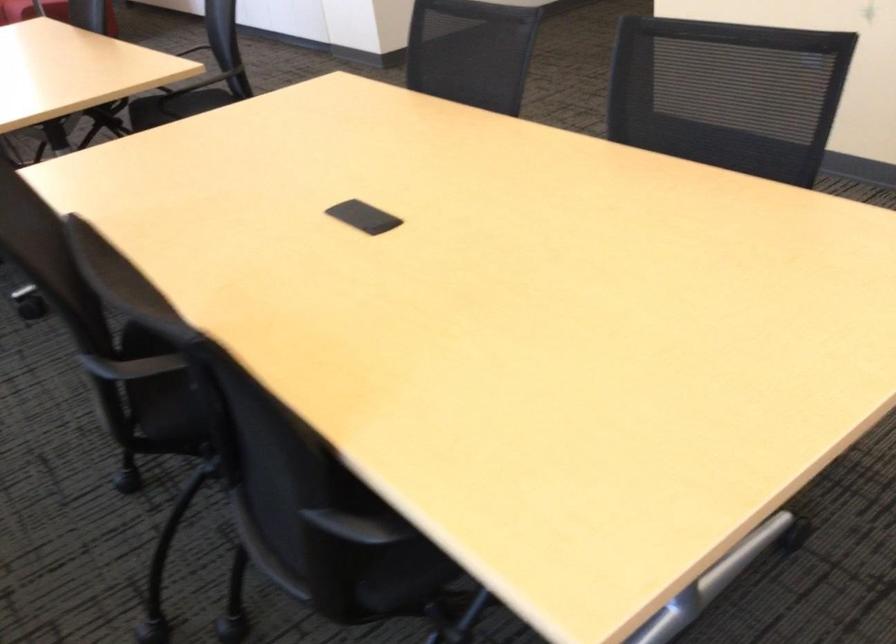
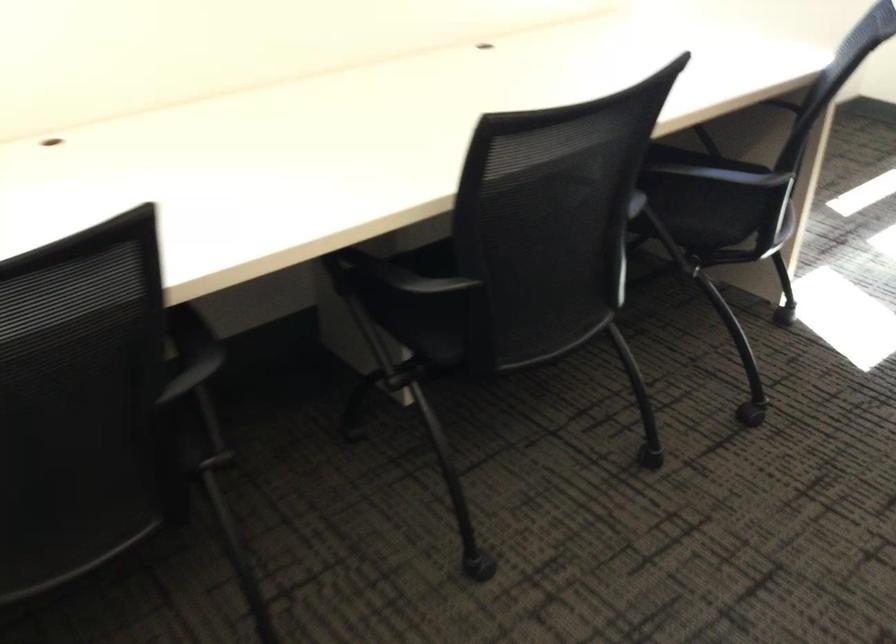
Based on the photo, the images are taken continuously from a first-person perspective. In which direction is your viewpoint rotating?

The camera rotated toward left-down.